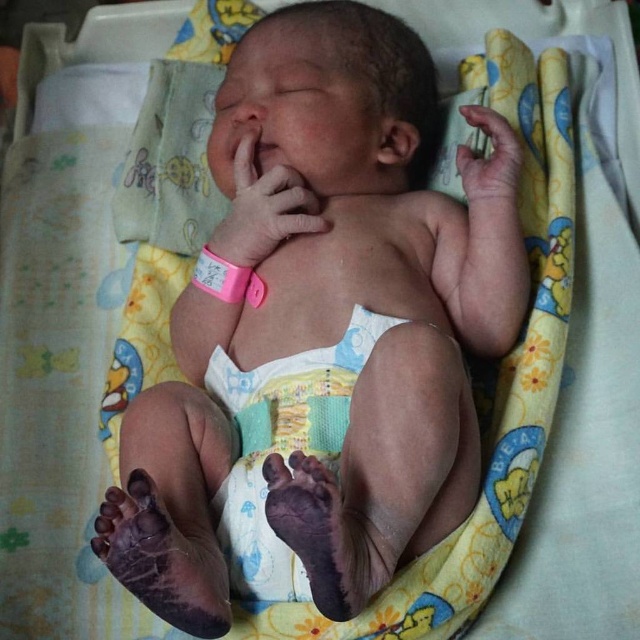
You are a nurse checking on a newborn in the hospital. You see the pink rubber band at center and the smooth skin hand at upper right. Which object is closer to you?

The pink rubber band at center is closer to you because it is further to the viewer than the smooth skin hand at upper right.

You are a nurse in a hospital nursery. You need to place the smooth white bib at center on the newborn baby. However, you also have to ensure that the smooth skin hand at upper right doesn not get caught in the bib. Based on their sizes, can the bib be positioned without covering the hand?

The smooth white bib at center is wider than the smooth skin hand at upper right, so it can be positioned to cover the baby without covering the hand, as the bib has enough width to accommodate the hand.

You are a nurse in a hospital nursery. You need to check the baby for any marks or rashes. The baby is currently lying on its back with its arms and legs spread out. You see the smooth white bib at center and the smooth skin hand at upper right. Which object is closer to the baby? Explain your answer using the scene description and the objects provided.

The smooth white bib at center is closer to the baby because it is located below the smooth skin hand at upper right. Since the hand is at the upper right, the bib being below it suggests it is positioned lower on the baby, likely near the torso area, making it closer to the baby compared to the hand which is farther out.